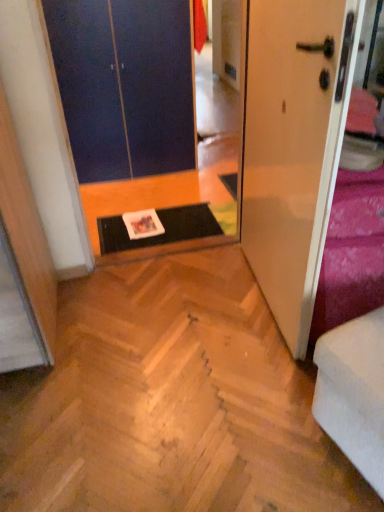
Locate an element on the screen. Image resolution: width=384 pixels, height=512 pixels. vacant space situated on the left part of white glossy door at right, the 1th door from the right is located at coordinates (180, 308).